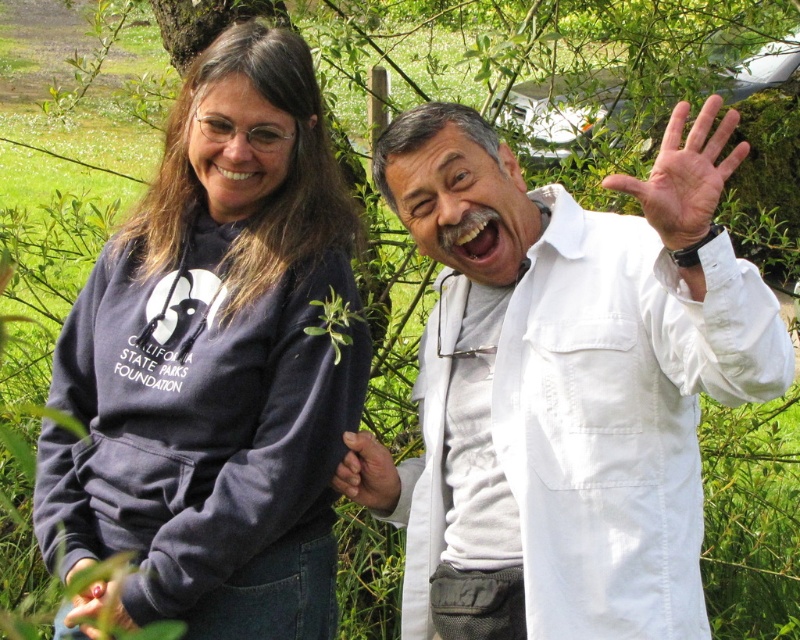
Question: Which point appears farthest from the camera in this image?

Choices:
 (A) (340, 481)
 (B) (312, 204)

Answer: (B)

Question: Is white cotton lab coat at right to the left of smooth skin hand at center from the viewer's perspective?

Choices:
 (A) yes
 (B) no

Answer: (B)

Question: Can you confirm if smooth skin hand at center is smaller than black matte hand at lower left?

Choices:
 (A) no
 (B) yes

Answer: (A)

Question: Is white cotton lab coat at right positioned at the back of white smooth hand at upper right?

Choices:
 (A) no
 (B) yes

Answer: (B)

Question: Which point is farther from the camera taking this photo?

Choices:
 (A) (424, 170)
 (B) (680, 168)
 (C) (80, 612)
 (D) (154, 522)

Answer: (D)

Question: Which of the following is the farthest from the observer?

Choices:
 (A) (364, 477)
 (B) (676, 212)

Answer: (A)